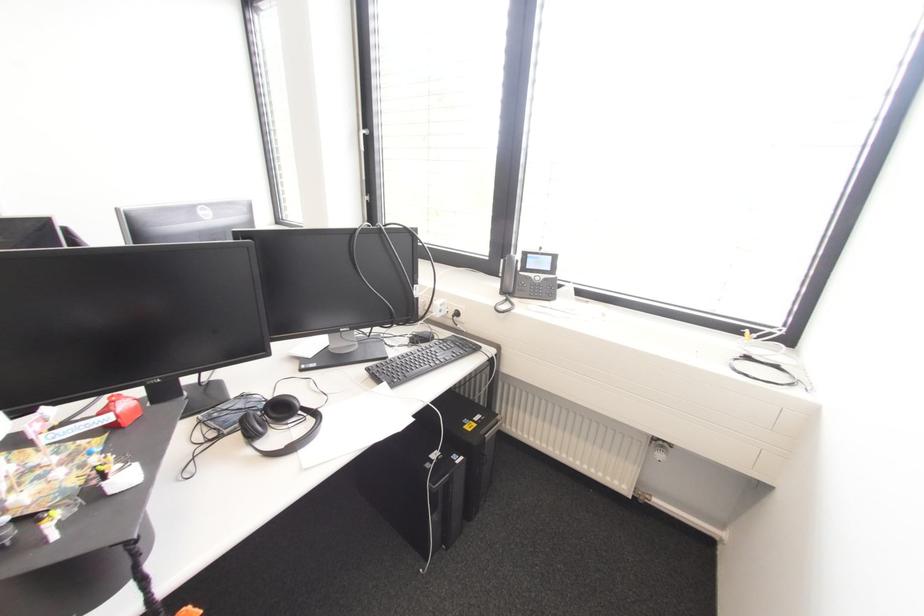
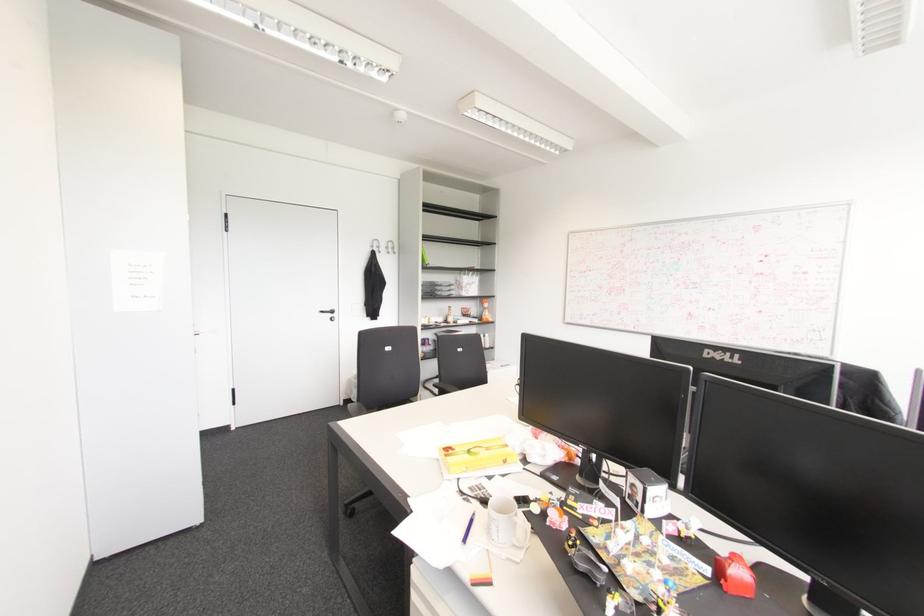
Question: The images are taken continuously from a first-person perspective. In which direction is your viewpoint rotating?

Choices:
 (A) Left
 (B) Right
 (C) Up
 (D) Down

Answer: (A)